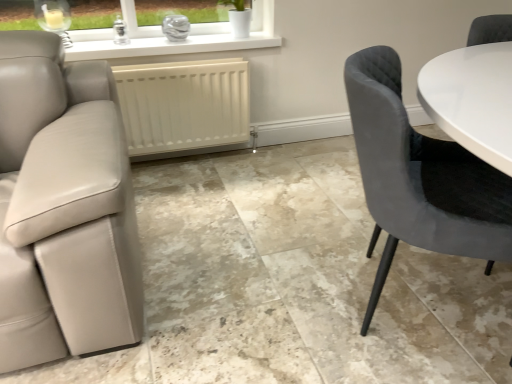
Where is `white matte radiator at center`? The height and width of the screenshot is (384, 512). white matte radiator at center is located at coordinates (183, 106).

What do you see at coordinates (183, 106) in the screenshot? This screenshot has height=384, width=512. I see `white matte radiator at center` at bounding box center [183, 106].

The width and height of the screenshot is (512, 384). Find the location of `velvet grey chair at right`. velvet grey chair at right is located at coordinates (420, 176).

What do you see at coordinates (420, 176) in the screenshot?
I see `velvet grey chair at right` at bounding box center [420, 176].

Locate an element on the screen. Image resolution: width=512 pixels, height=384 pixels. white matte radiator at center is located at coordinates (183, 106).

Which is more to the right, white matte radiator at center or velvet grey chair at right?

velvet grey chair at right is more to the right.

Is white matte radiator at center behind velvet grey chair at right?

Yes, it is.

Which is in front, point (219, 121) or point (502, 255)?

The point (502, 255) is more forward.

From the image's perspective, is white matte radiator at center over velvet grey chair at right?

Yes.

In the scene shown: From a real-world perspective, is white matte radiator at center under velvet grey chair at right?

Yes, from a real-world perspective, white matte radiator at center is beneath velvet grey chair at right.

Based on the photo, which object is wider, white matte radiator at center or velvet grey chair at right?

Wider between the two is velvet grey chair at right.

Is white matte radiator at center taller than velvet grey chair at right?

In fact, white matte radiator at center may be shorter than velvet grey chair at right.

Who is bigger, white matte radiator at center or velvet grey chair at right?

velvet grey chair at right is bigger.

Is white matte radiator at center not inside velvet grey chair at right?

That's correct, white matte radiator at center is outside of velvet grey chair at right.

Are white matte radiator at center and velvet grey chair at right far apart?

Yes.

Is white matte radiator at center turned away from velvet grey chair at right?

white matte radiator at center does not have its back to velvet grey chair at right.

What's the angular difference between white matte radiator at center and velvet grey chair at right's facing directions?

They differ by 62.6 degrees in their facing directions.

Measure the distance between white matte radiator at center and velvet grey chair at right.

The distance of white matte radiator at center from velvet grey chair at right is 4.10 feet.

Find the location of a particular element. chair that appears below the white matte radiator at center (from the image's perspective) is located at coordinates 420,176.

Which object is positioned more to the left, velvet grey chair at right or white matte radiator at center?

white matte radiator at center is more to the left.

Is the depth of velvet grey chair at right less than that of white matte radiator at center?

Yes, velvet grey chair at right is closer to the viewer.

Which is farther, [403,212] or [227,98]?

The point [227,98] is behind.

From the image's perspective, does velvet grey chair at right appear higher than white matte radiator at center?

No, from the image's perspective, velvet grey chair at right is not on top of white matte radiator at center.

From a real-world perspective, between velvet grey chair at right and white matte radiator at center, who is vertically higher?

velvet grey chair at right.

Which of these two, velvet grey chair at right or white matte radiator at center, is thinner?

With smaller width is white matte radiator at center.

Which of these two, velvet grey chair at right or white matte radiator at center, stands taller?

With more height is velvet grey chair at right.

Who is bigger, velvet grey chair at right or white matte radiator at center?

velvet grey chair at right is bigger.

Is velvet grey chair at right situated inside white matte radiator at center or outside?

velvet grey chair at right is outside white matte radiator at center.

Is velvet grey chair at right not close to white matte radiator at center?

velvet grey chair at right is far away from white matte radiator at center.

Is velvet grey chair at right turned away from white matte radiator at center?

That's not correct — velvet grey chair at right is not looking away from white matte radiator at center.

Locate an element on the screen. This screenshot has height=384, width=512. chair in front of the white matte radiator at center is located at coordinates (420, 176).

Find the location of a particular element. chair above the white matte radiator at center (from a real-world perspective) is located at coordinates (420, 176).

Find the location of a particular element. The height and width of the screenshot is (384, 512). chair located on the right of white matte radiator at center is located at coordinates (420, 176).